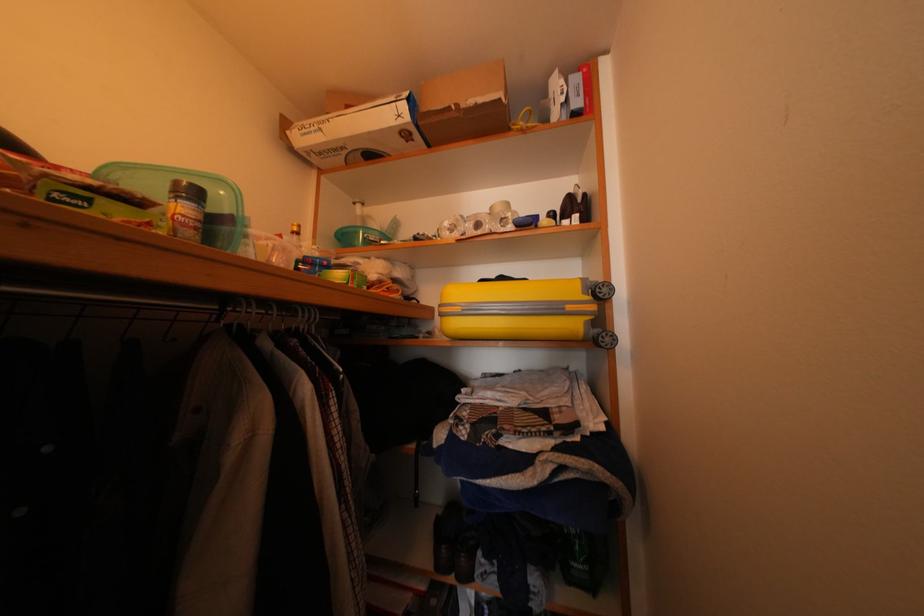
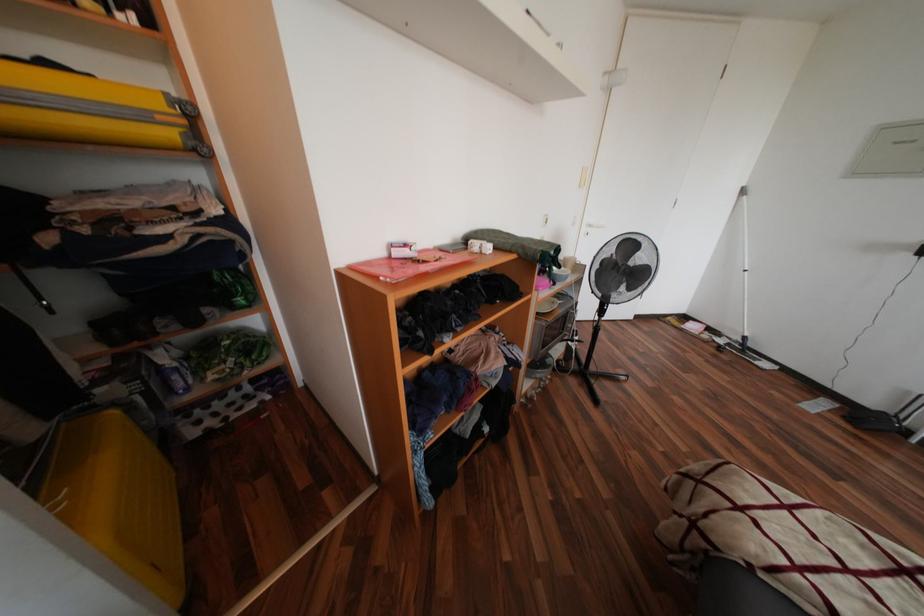
How did the camera likely rotate?

The camera rotated toward right-down.